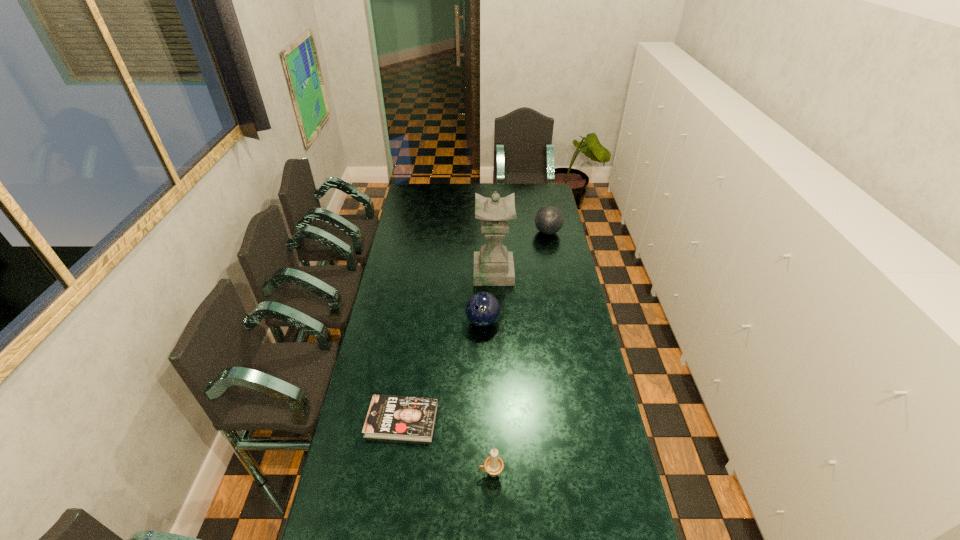
This screenshot has width=960, height=540. I want to click on vacant area that lies between the fourth nearest object and the farther bowling ball, so click(x=520, y=252).

Identify the location of vacant space that is in between the tallest object and the nearest object. The height and width of the screenshot is (540, 960). (492, 373).

Identify the location of free spot between the farthest object and the leftmost object. (475, 326).

Find the location of `unoccupied area between the left bowling ball and the nearest object`. unoccupied area between the left bowling ball and the nearest object is located at coordinates (487, 397).

This screenshot has width=960, height=540. I want to click on free space between the nearest object and the left bowling ball, so click(487, 397).

Where is `unoccupied position between the candle_holder and the shortest object`? unoccupied position between the candle_holder and the shortest object is located at coordinates (446, 447).

Where is `object identified as the closest to the shortest object`? The height and width of the screenshot is (540, 960). object identified as the closest to the shortest object is located at coordinates (493, 465).

Identify which object is the second closest to the left bowling ball. Please provide its 2D coordinates. Your answer should be formatted as a tuple, i.e. [(x, y)], where the tuple contains the x and y coordinates of a point satisfying the conditions above.

[(403, 418)]

Locate an element on the screen. The image size is (960, 540). vacant space that satisfies the following two spatial constraints: 1. at the front opening of the sculpture; 2. on the front side of the book is located at coordinates (499, 420).